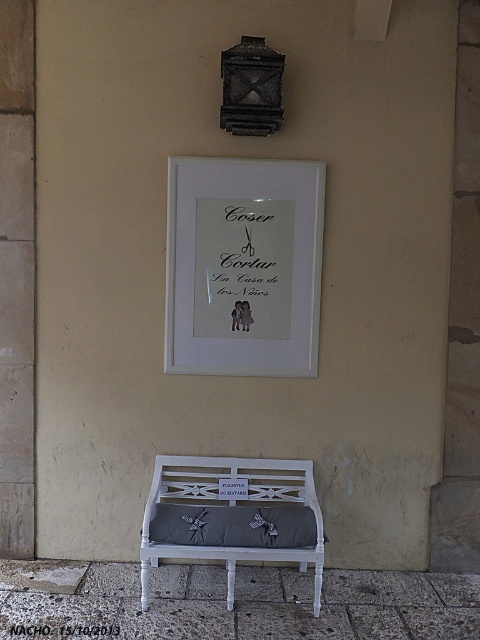
Does black paper at center have a smaller size compared to white wood sign at center?

No.

Can you confirm if black paper at center is wider than white wood sign at center?

Indeed, black paper at center has a greater width compared to white wood sign at center.

I want to click on black paper at center, so click(x=60, y=630).

What are the coordinates of `black paper at center` in the screenshot? It's located at (60, 630).

Is point (212, 184) less distant than point (197, 547)?

No.

Does white matte picture frame at upper center have a lesser width compared to white painted wood park bench at lower center?

Yes.

This screenshot has width=480, height=640. What do you see at coordinates (243, 266) in the screenshot?
I see `white matte picture frame at upper center` at bounding box center [243, 266].

You are a GUI agent. You are given a task and a screenshot of the screen. Output one action in this format:
    pyautogui.click(x=<x>, y=<y>)
    Task: Click on the white matte picture frame at upper center
    This screenshot has width=480, height=640.
    Given the screenshot: What is the action you would take?
    pyautogui.click(x=243, y=266)

Is gray fabric pillow at center to the right of black paper at center from the viewer's perspective?

Indeed, gray fabric pillow at center is positioned on the right side of black paper at center.

Is point (216, 508) behind point (11, 636)?

Yes, point (216, 508) is farther from viewer.

Where is `gray fabric pillow at center`? The image size is (480, 640). gray fabric pillow at center is located at coordinates (233, 525).